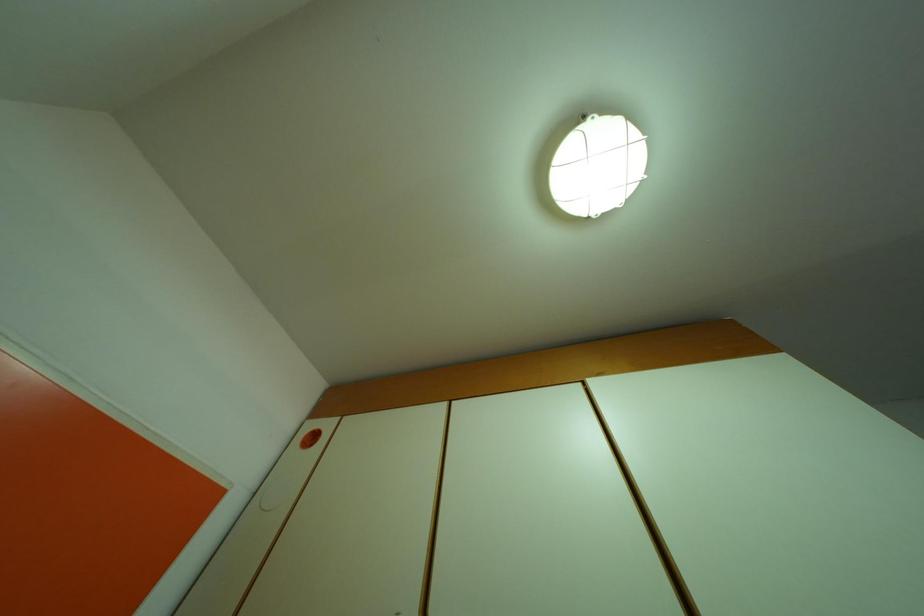
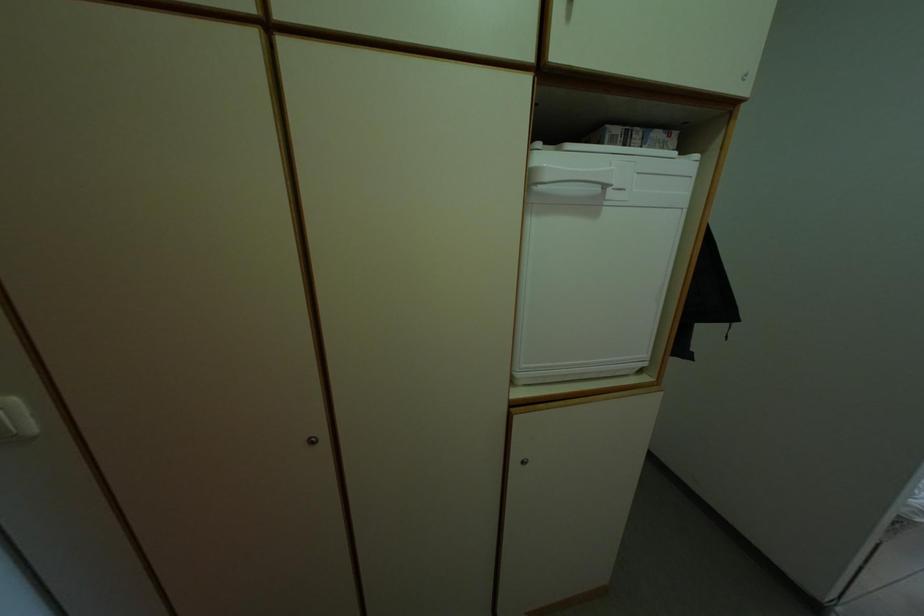
The first image is from the beginning of the video and the second image is from the end. How did the camera likely rotate when shooting the video?

The camera rotated toward right-down.